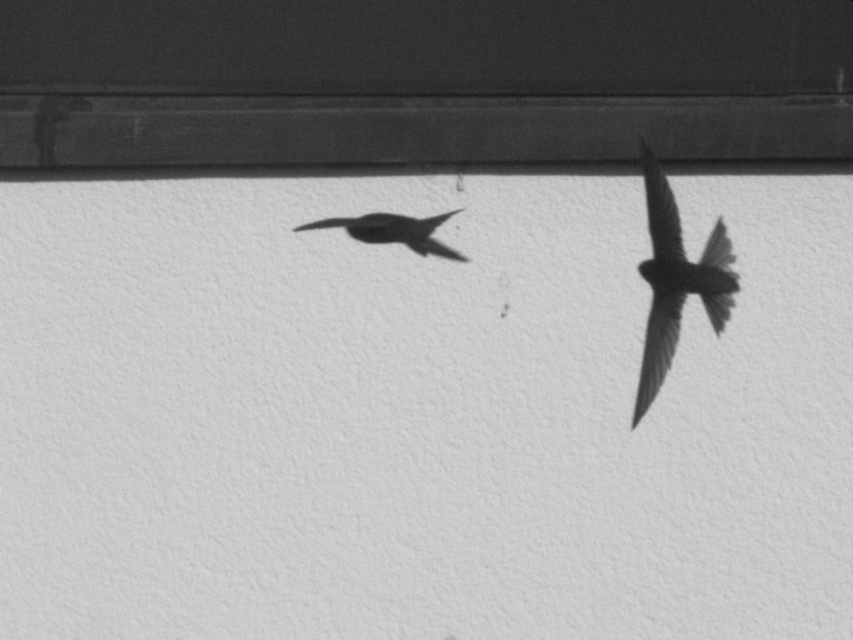
Between silvery metallic bird at right and smooth black bird at center, which one is positioned lower?

silvery metallic bird at right is below.

Does silvery metallic bird at right lie in front of smooth black bird at center?

No, silvery metallic bird at right is behind smooth black bird at center.

Between point (729, 301) and point (347, 228), which one is positioned in front?

Point (347, 228) is in front.

At what (x,y) coordinates should I click in order to perform the action: click on silvery metallic bird at right. Please return your answer as a coordinate pair (x, y). This screenshot has width=853, height=640. Looking at the image, I should click on (675, 280).